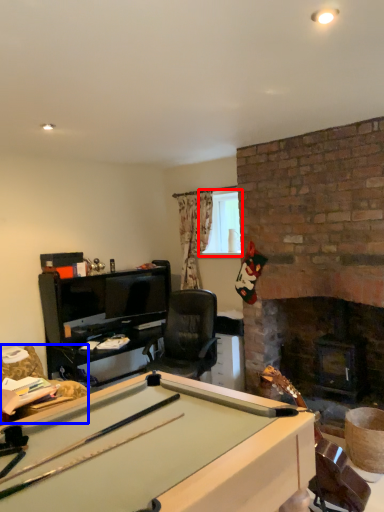
Question: Which of the following is the closest to the observer, window screen (highlighted by a red box) or swivel chair (highlighted by a blue box)?

Choices:
 (A) window screen
 (B) swivel chair

Answer: (B)